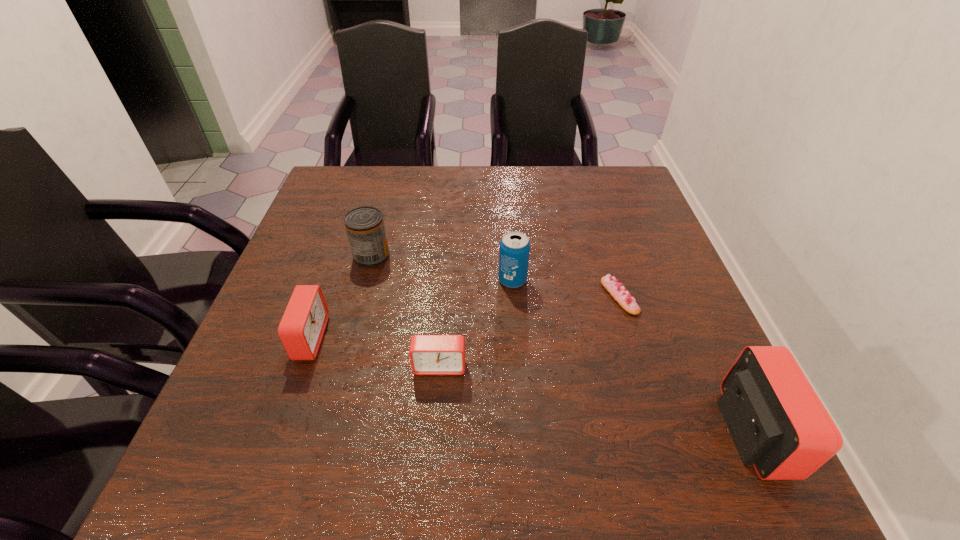
Locate an element on the screen. This screenshot has height=540, width=960. alarm clock identified as the closest to the farthest object is located at coordinates (302, 327).

Locate an element on the screen. free space that satisfies the following two spatial constraints: 1. on the front side of the farthest object; 2. on the front-facing side of the leftmost alarm clock is located at coordinates (349, 338).